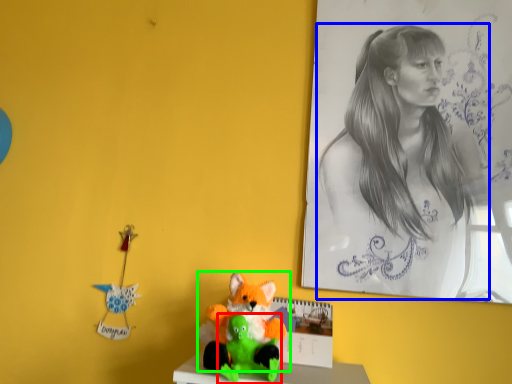
Question: Which is farther away from toy (highlighted by a red box)? woman (highlighted by a blue box) or toy (highlighted by a green box)?

Choices:
 (A) woman
 (B) toy

Answer: (A)